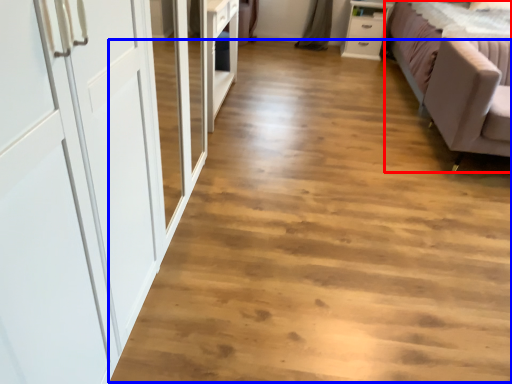
Question: Which object appears closest to the camera in this image, studio couch (highlighted by a red box) or plain (highlighted by a blue box)?

Choices:
 (A) studio couch
 (B) plain

Answer: (B)